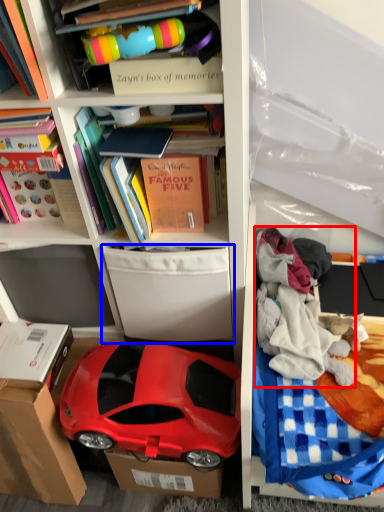
Question: Among these objects, which one is nearest to the camera, clothing (highlighted by a red box) or storage box (highlighted by a blue box)?

Choices:
 (A) clothing
 (B) storage box

Answer: (B)